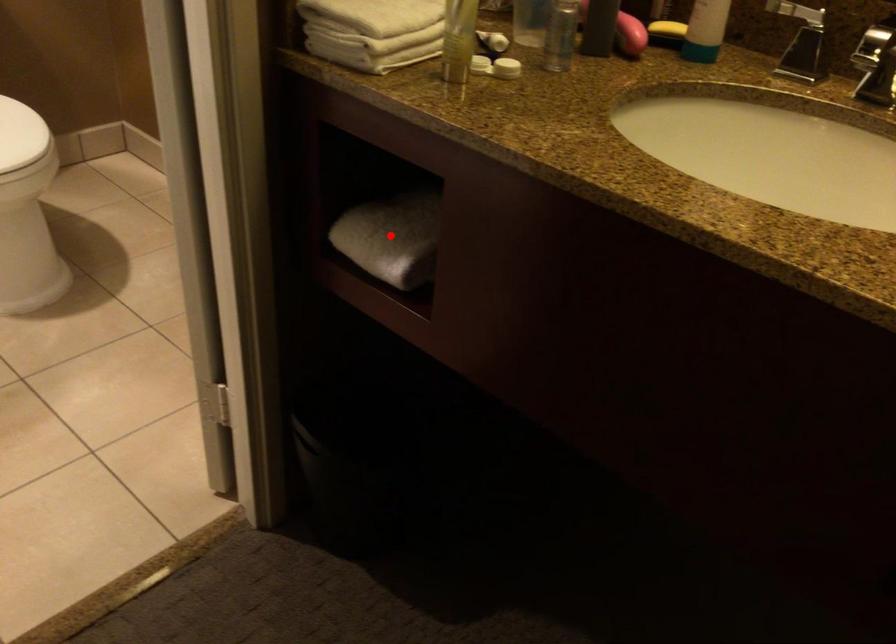
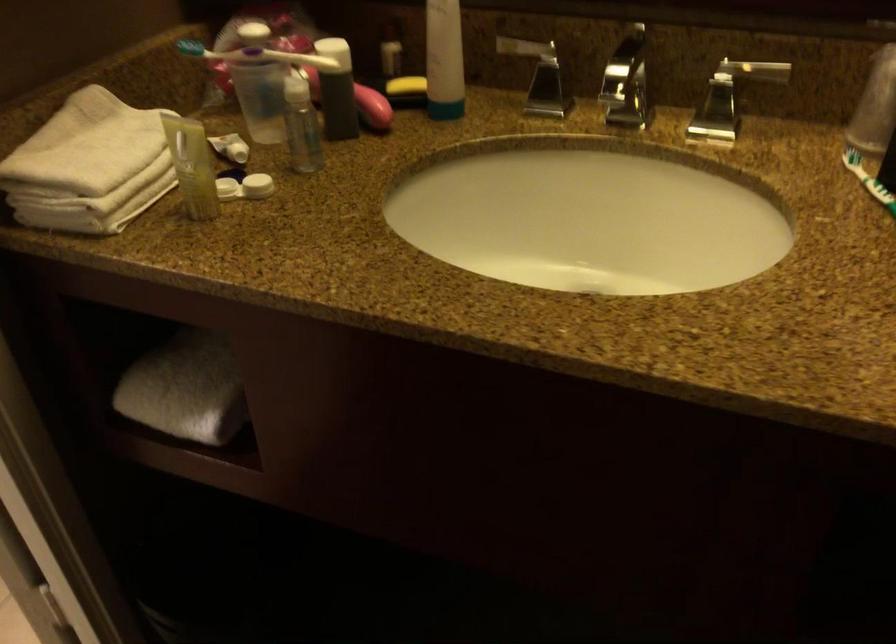
Locate, in the second image, the point that corresponds to the highlighted location in the first image.

(185, 389)